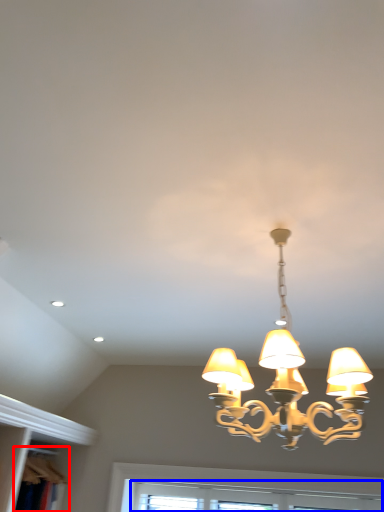
Question: Among these objects, which one is farthest to the camera, bookshelf (highlighted by a red box) or window (highlighted by a blue box)?

Choices:
 (A) bookshelf
 (B) window

Answer: (B)